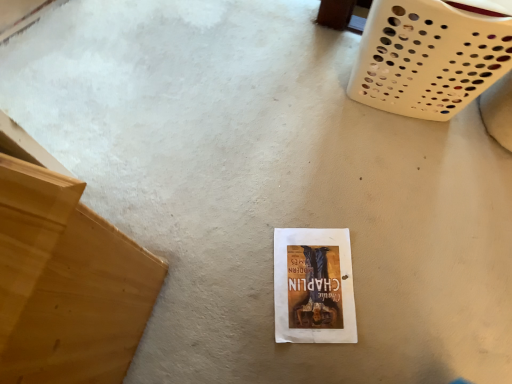
Where is `vacant space to the right of white paper at center`? Image resolution: width=512 pixels, height=384 pixels. vacant space to the right of white paper at center is located at coordinates (392, 283).